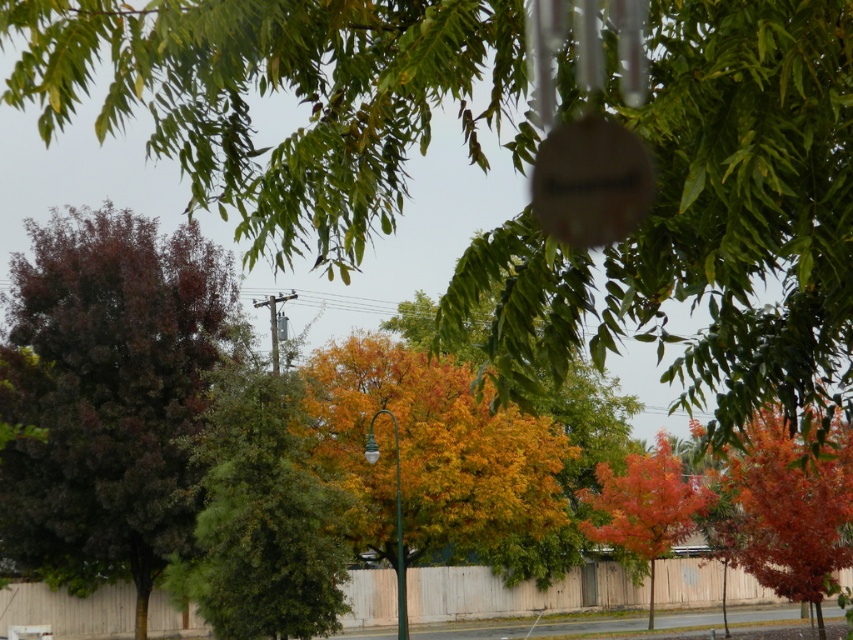
You are planning to plant two trees in your backyard. You have a space that can accommodate a tree with a width of 10 meters. The green leafy tree at upper center and the orange glossy tree at center are options. Based on their sizes, which tree would require more space?

The green leafy tree at upper center requires more space because its width is larger than the orange glossy tree at center.

You are standing in the autumn scene and want to place a small bench between the green leafy tree at upper center and the dark purple foliage at left. Based on their positions, which object should the bench be closer to?

The green leafy tree at upper center is located above the dark purple foliage at left, so the bench should be placed closer to the dark purple foliage at left to be between them.